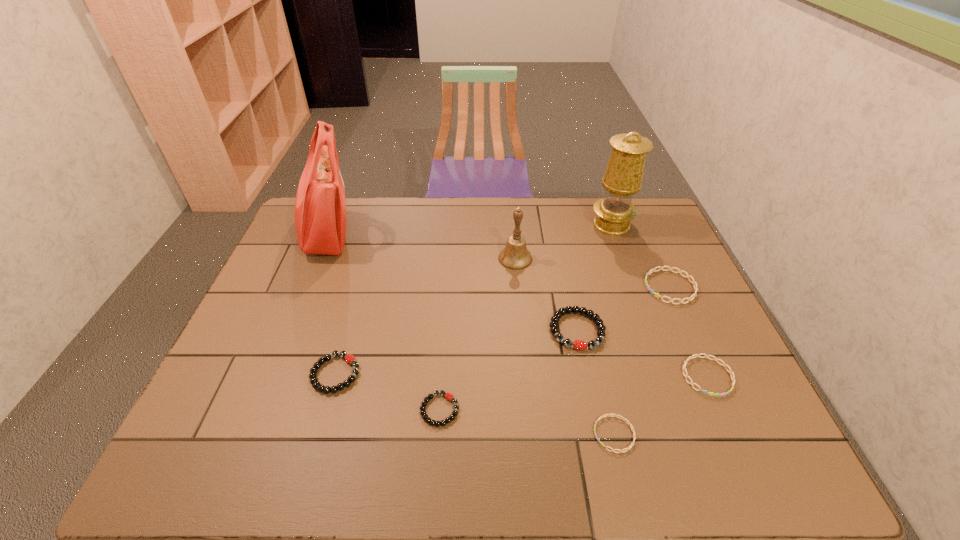
This screenshot has height=540, width=960. What are the coordinates of `object present at the near edge` in the screenshot? It's located at (632, 444).

The image size is (960, 540). In order to click on object located in the left edge section of the desktop in this screenshot , I will do `click(320, 208)`.

You are a GUI agent. You are given a task and a screenshot of the screen. Output one action in this format:
    pyautogui.click(x=<x>, y=<y>)
    Task: Click on the oil lamp positioned at the right edge
    This screenshot has height=540, width=960.
    Given the screenshot: What is the action you would take?
    pyautogui.click(x=623, y=176)

You are a GUI agent. You are given a task and a screenshot of the screen. Output one action in this format:
    pyautogui.click(x=<x>, y=<y>)
    Task: Click on the object positioned at the far left corner
    
    Given the screenshot: What is the action you would take?
    pyautogui.click(x=320, y=208)

Identify the location of object at the far right corner. The width and height of the screenshot is (960, 540). (623, 176).

Locate an element on the screen. vacant region at the far edge is located at coordinates (489, 213).

Locate an element on the screen. This screenshot has height=540, width=960. free space at the near edge of the desktop is located at coordinates (414, 476).

Image resolution: width=960 pixels, height=540 pixels. I want to click on blank space at the left edge of the desktop, so click(285, 375).

Find the location of a particular element. This screenshot has height=540, width=960. vacant space at the right edge of the desktop is located at coordinates (702, 329).

The width and height of the screenshot is (960, 540). In order to click on blank space at the far right corner in this screenshot , I will do `click(642, 236)`.